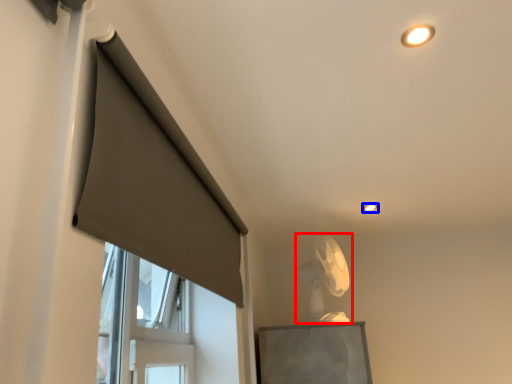
Question: Which object is further to the camera taking this photo, fan (highlighted by a red box) or lighting (highlighted by a blue box)?

Choices:
 (A) fan
 (B) lighting

Answer: (B)